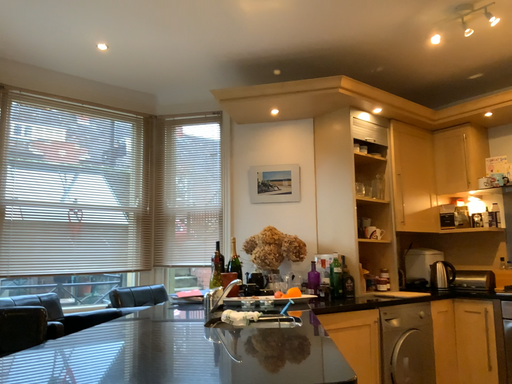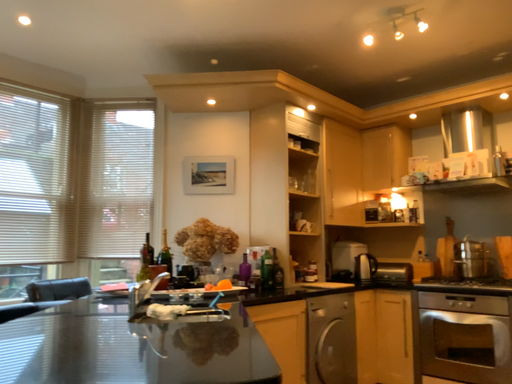
Question: How did the camera likely rotate when shooting the video?

Choices:
 (A) rotated right
 (B) rotated left

Answer: (A)